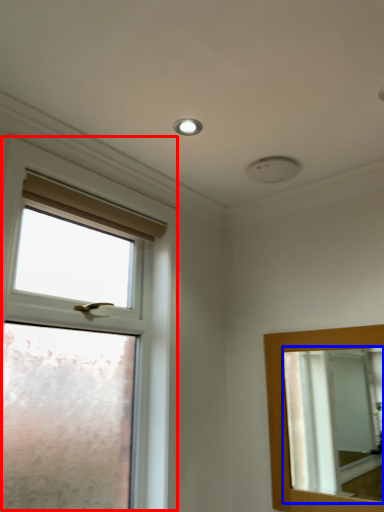
Question: Among these objects, which one is farthest to the camera, window (highlighted by a red box) or mirror (highlighted by a blue box)?

Choices:
 (A) window
 (B) mirror

Answer: (B)